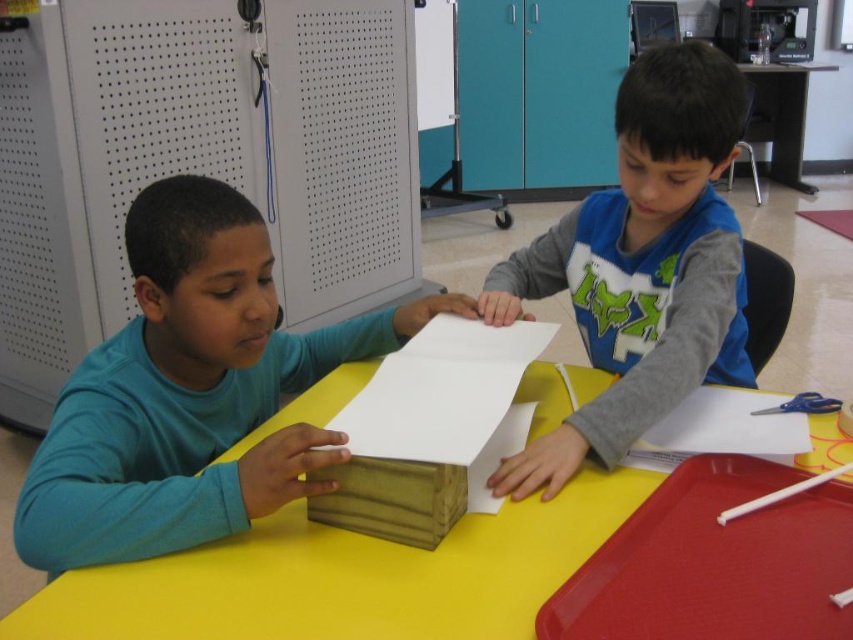
Is matte gray shirt at center above wooden block at center?

Yes.

Is point (543, 467) less distant than point (463, 420)?

No, it is behind (463, 420).

The width and height of the screenshot is (853, 640). I want to click on matte gray shirt at center, so click(x=641, y=266).

Between matte wood block at left and yellow matte table at center, which one appears on the right side from the viewer's perspective?

Positioned to the right is yellow matte table at center.

Which is above, matte wood block at left or yellow matte table at center?

matte wood block at left is higher up.

What do you see at coordinates (190, 392) in the screenshot?
I see `matte wood block at left` at bounding box center [190, 392].

Identify the location of matte wood block at left. This screenshot has width=853, height=640. (190, 392).

Based on the photo, does yellow matte table at center have a larger size compared to wooden block at center?

Indeed, yellow matte table at center has a larger size compared to wooden block at center.

In the scene shown: Is yellow matte table at center thinner than wooden block at center?

In fact, yellow matte table at center might be wider than wooden block at center.

Is point (192, 573) positioned after point (532, 326)?

No.

Find the location of a particular element. This screenshot has width=853, height=640. yellow matte table at center is located at coordinates (345, 577).